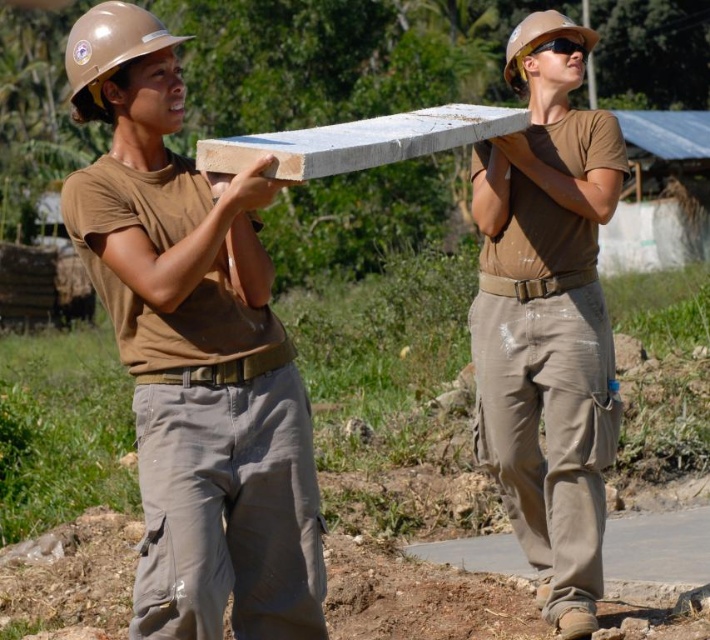
Looking at this image, you are a safety inspector checking the hard hats in the image. The two hard hats are labeled as matte brown hard hat at upper left and matte brown hard hat at upper center. Which one is smaller in size?

The matte brown hard hat at upper left is smaller in size compared to the matte brown hard hat at upper center.

You are a safety inspector checking the equipment of two workers. You notice both have a matte concrete block at upper center and a matte brown hard hat at upper center. Which object has a smaller width?

The matte concrete block at upper center has a lesser width compared to the matte brown hard hat at upper center.